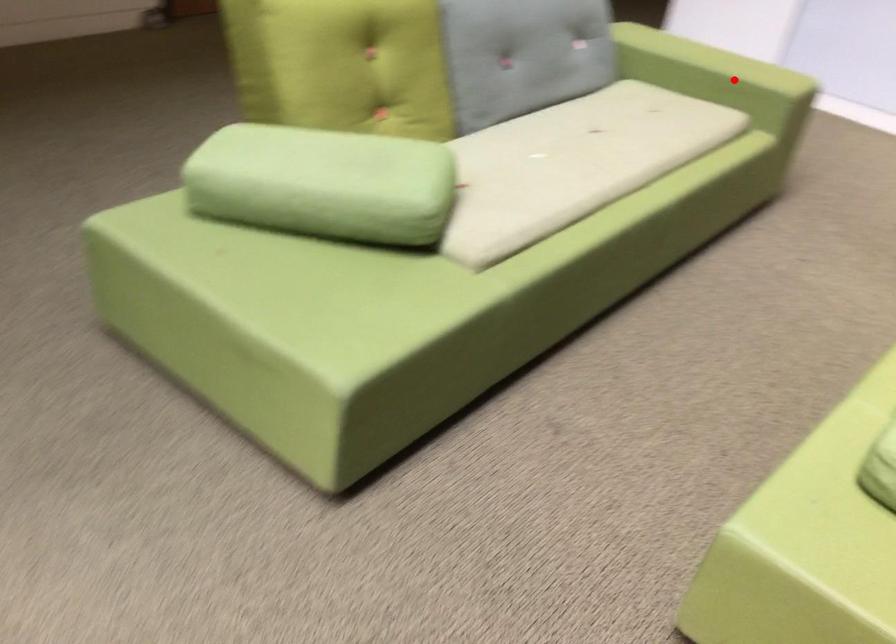
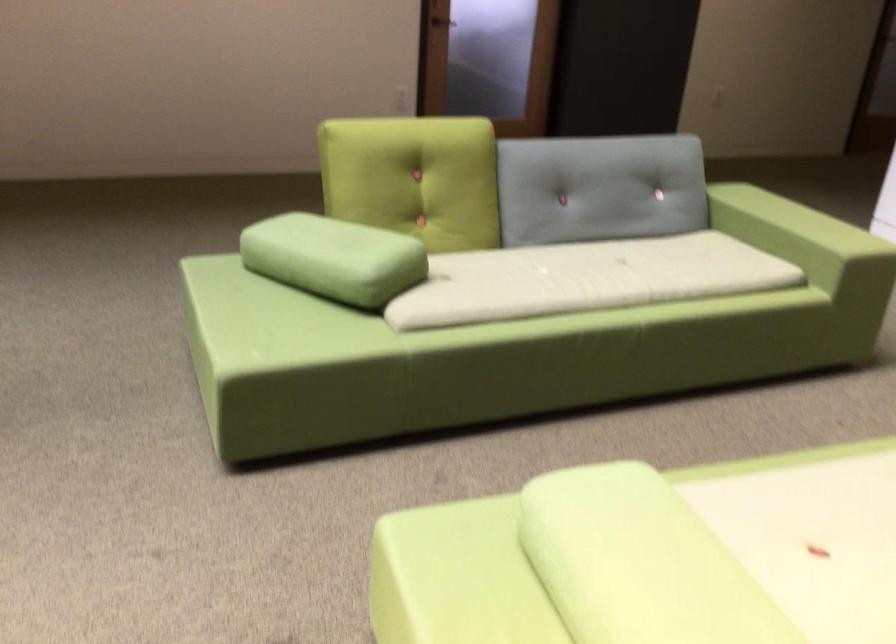
In the second image, find the point that corresponds to the highlighted location in the first image.

(794, 241)